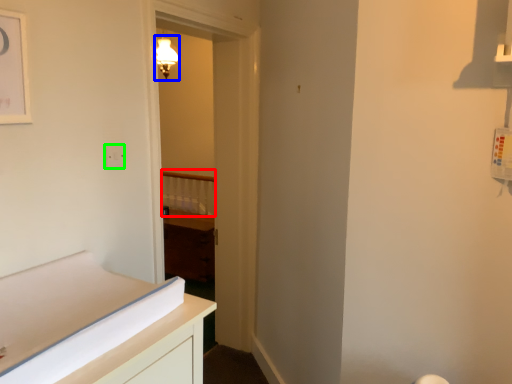
Question: Which object is the farthest from balustrade (highlighted by a red box)? Choose among these: light fixture (highlighted by a blue box) or electric outlet (highlighted by a green box).

Choices:
 (A) light fixture
 (B) electric outlet

Answer: (B)